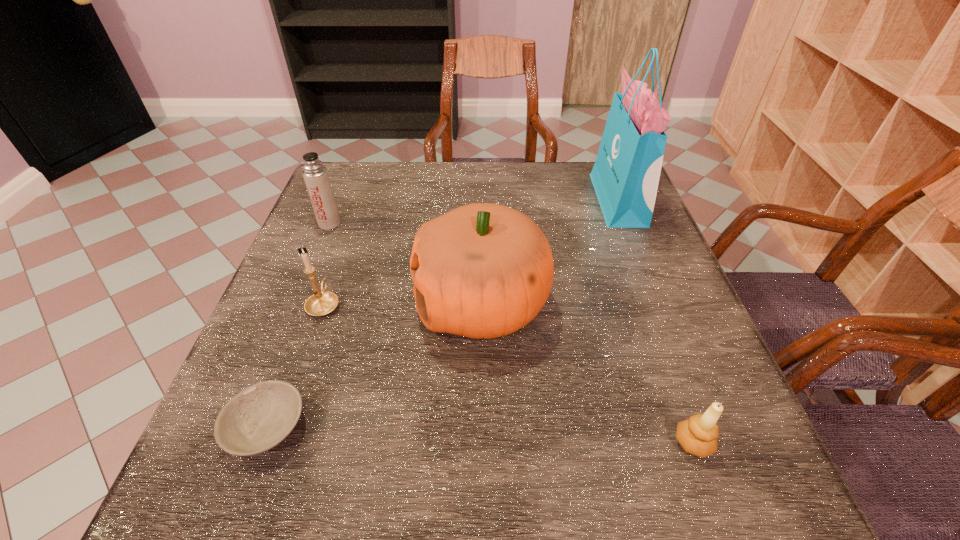
The image size is (960, 540). I want to click on free space located on the face of the third object from right to left, so click(x=287, y=304).

At what (x,y) coordinates should I click in order to perform the action: click on vacant region located on the face of the third object from right to left. Please return your answer as a coordinate pair (x, y). This screenshot has height=540, width=960. Looking at the image, I should click on (301, 304).

Image resolution: width=960 pixels, height=540 pixels. In order to click on vacant space positioned on the face of the third object from right to left in this screenshot , I will do (354, 304).

Where is `free space located 0.090m on the back of the thermos bottle`? This screenshot has height=540, width=960. free space located 0.090m on the back of the thermos bottle is located at coordinates (340, 197).

Where is `free space located 0.200m on the handle side of the fourth tallest object`? This screenshot has height=540, width=960. free space located 0.200m on the handle side of the fourth tallest object is located at coordinates (348, 232).

You are a GUI agent. You are given a task and a screenshot of the screen. Output one action in this format:
    pyautogui.click(x=<x>, y=<y>)
    Task: Click on the free region located on the handle side of the fourth tallest object
    The image size is (960, 540).
    Given the screenshot: What is the action you would take?
    pyautogui.click(x=353, y=220)

Locate an element on the screen. vacant point located on the handle side of the fourth tallest object is located at coordinates (340, 259).

Where is `free space located on the right of the right candle_holder`? free space located on the right of the right candle_holder is located at coordinates (745, 443).

The image size is (960, 540). In order to click on vacant space located 0.060m on the front of the shortest object in this screenshot , I will do `click(236, 509)`.

At what (x,y) coordinates should I click in order to perform the action: click on object that is at the far edge. Please return your answer as a coordinate pair (x, y). The image size is (960, 540). Looking at the image, I should click on click(625, 176).